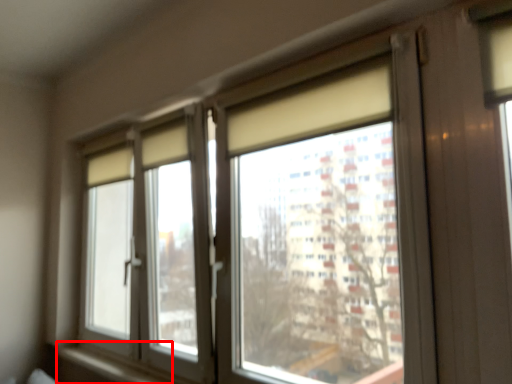
Question: From the image's perspective, where is window sill (annotated by the red box) located relative to window?

Choices:
 (A) above
 (B) below

Answer: (B)